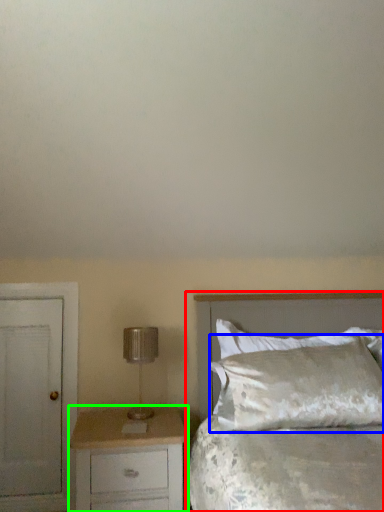
Question: Which object is positioned farthest from bed (highlighted by a red box)? Select from pillow (highlighted by a blue box) and chest of drawers (highlighted by a green box).

Choices:
 (A) pillow
 (B) chest of drawers

Answer: (B)